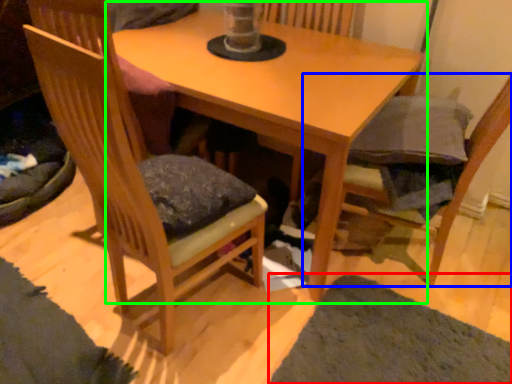
Question: Which object is positioned farthest from mat (highlighted by a red box)? Select from chair (highlighted by a blue box) and table (highlighted by a green box).

Choices:
 (A) chair
 (B) table

Answer: (B)